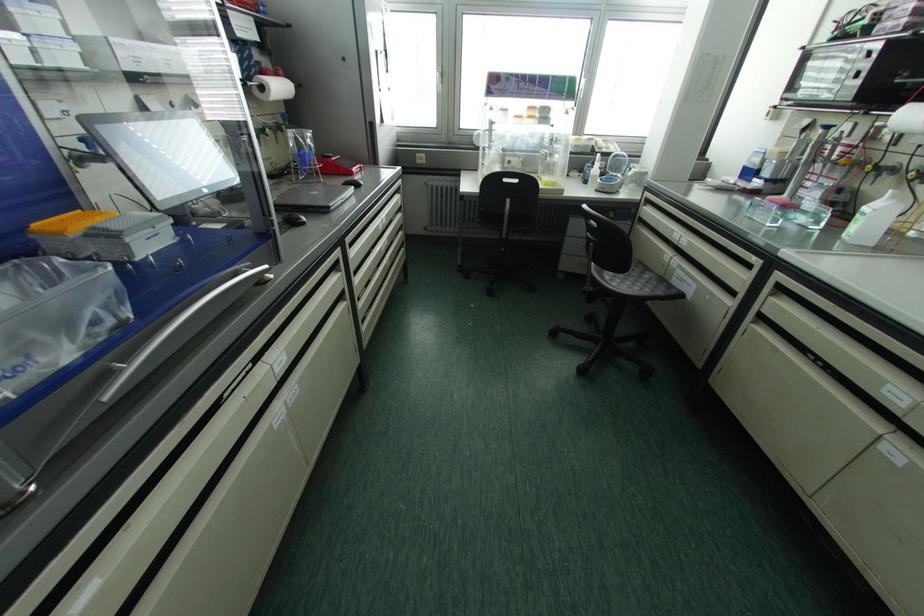
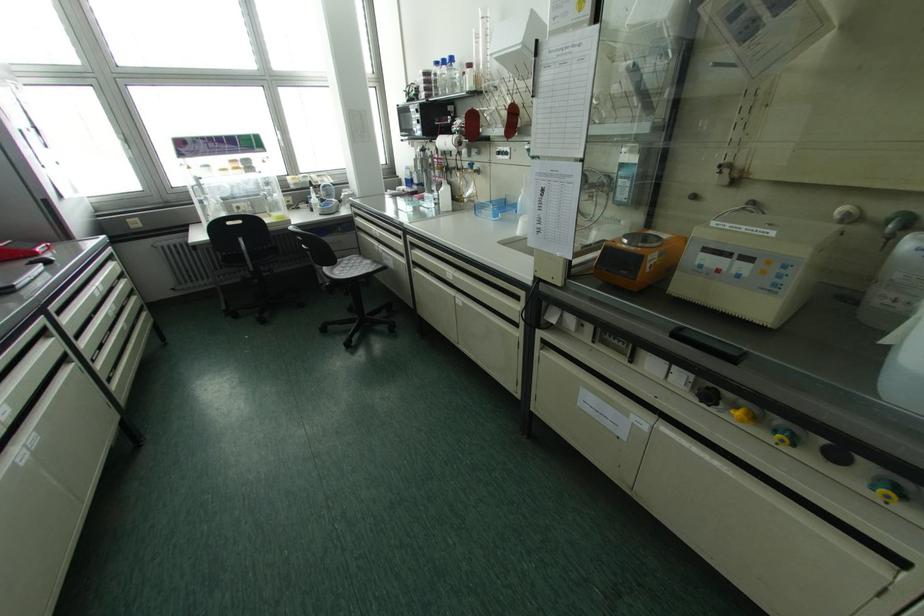
Where in the second image is the point corresponding to the point at 660,293 from the first image?

(370, 270)